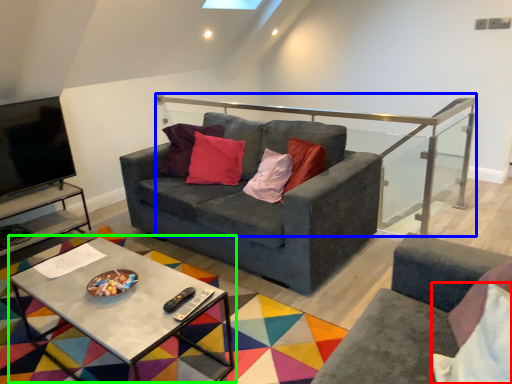
Question: Which is farther away from pillow (highlighted by a red box)? balustrade (highlighted by a blue box) or coffee table (highlighted by a green box)?

Choices:
 (A) balustrade
 (B) coffee table

Answer: (A)